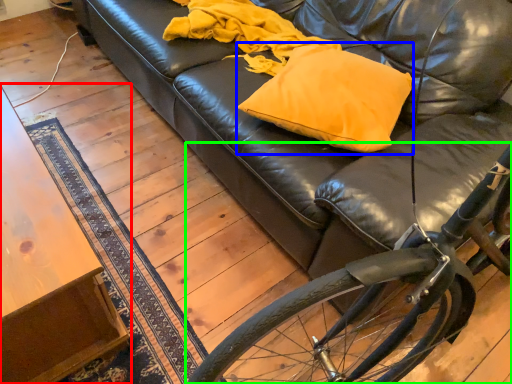
Question: Which object is positioned farthest from table (highlighted by a red box)? Select from throw pillow (highlighted by a blue box) and bicycle (highlighted by a green box).

Choices:
 (A) throw pillow
 (B) bicycle

Answer: (A)